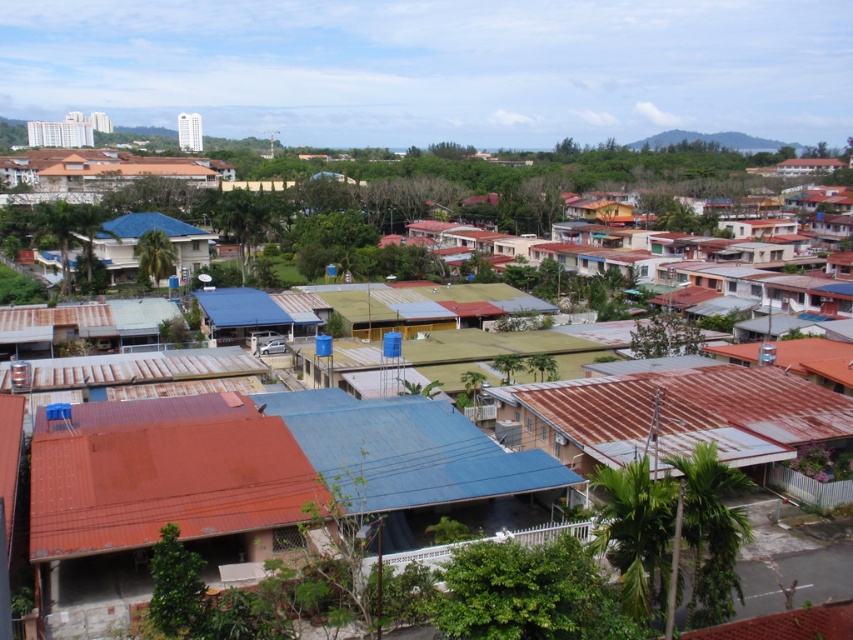
Which is more to the right, rusty corrugated metal hut at lower left or blue matte house at center?

From the viewer's perspective, rusty corrugated metal hut at lower left appears more on the right side.

Can you confirm if rusty corrugated metal hut at lower left is positioned above blue matte house at center?

Incorrect, rusty corrugated metal hut at lower left is not positioned above blue matte house at center.

Is point (77, 468) farther from viewer compared to point (114, 269)?

No.

Locate an element on the screen. rusty corrugated metal hut at lower left is located at coordinates (241, 483).

Does point (405, 497) come behind point (619, 394)?

No, it is not.

Locate an element on the screen. The image size is (853, 640). rusty corrugated metal hut at lower left is located at coordinates (241, 483).

Does rusty metal hut at lower right have a lesser width compared to blue matte house at center?

Incorrect, rusty metal hut at lower right's width is not less than blue matte house at center's.

Who is more distant from viewer, (677, 428) or (189, 227)?

Point (189, 227)

The width and height of the screenshot is (853, 640). Describe the element at coordinates (674, 417) in the screenshot. I see `rusty metal hut at lower right` at that location.

Locate an element on the screen. The width and height of the screenshot is (853, 640). rusty metal hut at lower right is located at coordinates (674, 417).